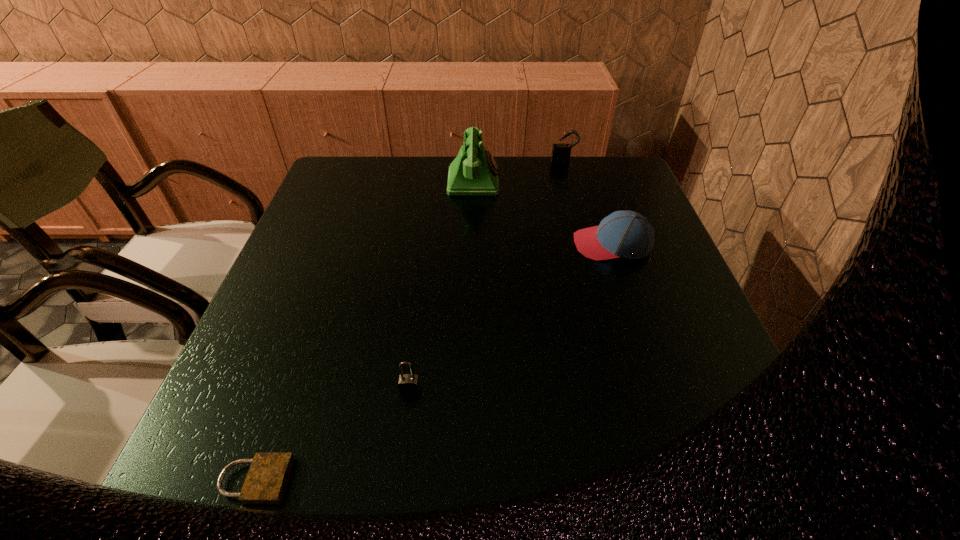
You are a GUI agent. You are given a task and a screenshot of the screen. Output one action in this format:
    pyautogui.click(x=<x>, y=<y>)
    Task: Click on the free space located 0.310m with the keyhole on the front of the rightmost padlock
    
    Given the screenshot: What is the action you would take?
    pyautogui.click(x=581, y=225)

This screenshot has width=960, height=540. In order to click on vacant region located on the front-facing side of the baseball cap in this screenshot , I will do `click(540, 244)`.

You are a GUI agent. You are given a task and a screenshot of the screen. Output one action in this format:
    pyautogui.click(x=<x>, y=<y>)
    Task: Click on the vacant region located on the front-facing side of the baseball cap
    Image resolution: width=960 pixels, height=540 pixels.
    Given the screenshot: What is the action you would take?
    pyautogui.click(x=415, y=244)

Locate an element on the screen. The width and height of the screenshot is (960, 540). vacant position located 0.310m on the front-facing side of the baseball cap is located at coordinates (447, 244).

Image resolution: width=960 pixels, height=540 pixels. Find the location of `vacant space located on the shackle of the second farthest padlock`. vacant space located on the shackle of the second farthest padlock is located at coordinates (400, 462).

I want to click on vacant space located on the keyhole side of the leftmost object, so click(386, 480).

Identify the location of telephone present at the far edge. (474, 171).

Find the location of a particular element. The image size is (960, 540). padlock that is at the far edge is located at coordinates (561, 153).

This screenshot has width=960, height=540. What are the coordinates of `object present at the near edge` in the screenshot? It's located at (265, 483).

Identify the location of object at the left edge. This screenshot has width=960, height=540. (265, 483).